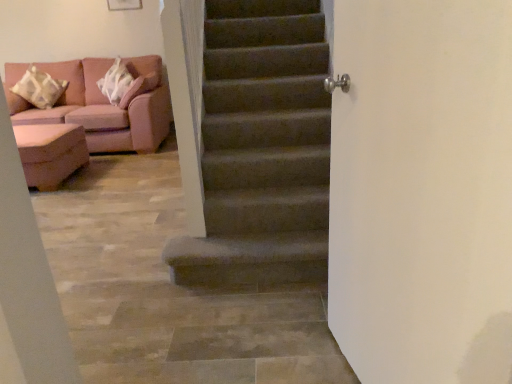
What do you see at coordinates (422, 190) in the screenshot?
I see `satin silver handle at upper right` at bounding box center [422, 190].

Locate an element on the screen. Image resolution: width=512 pixels, height=384 pixels. satin silver handle at upper right is located at coordinates (422, 190).

In order to face satin silver handle at upper right, should I rotate leftwards or rightwards?

Rotate right and turn 17.256 degrees.

At what (x,y) coordinates should I click in order to perform the action: click on satin silver handle at upper right. Please return your answer as a coordinate pair (x, y). The height and width of the screenshot is (384, 512). Looking at the image, I should click on (422, 190).